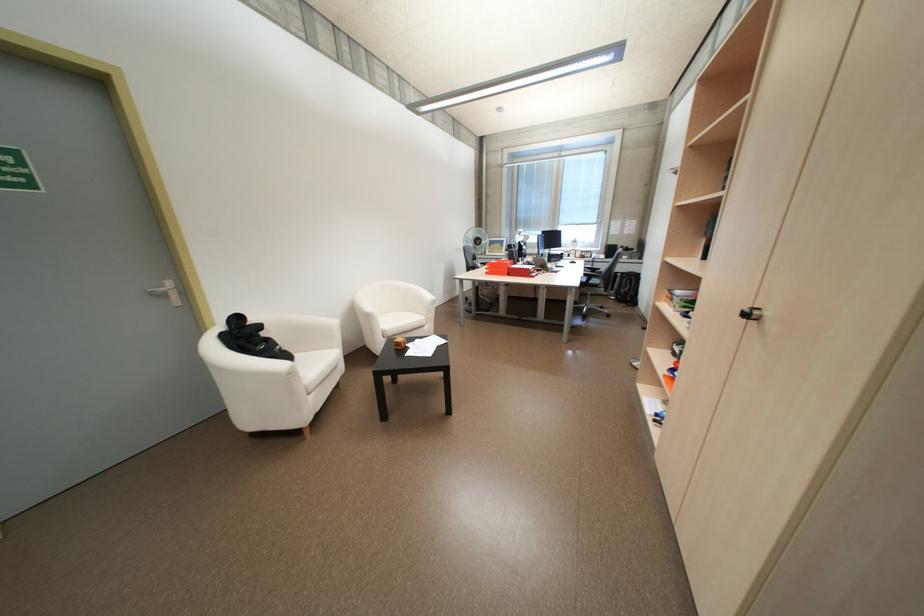
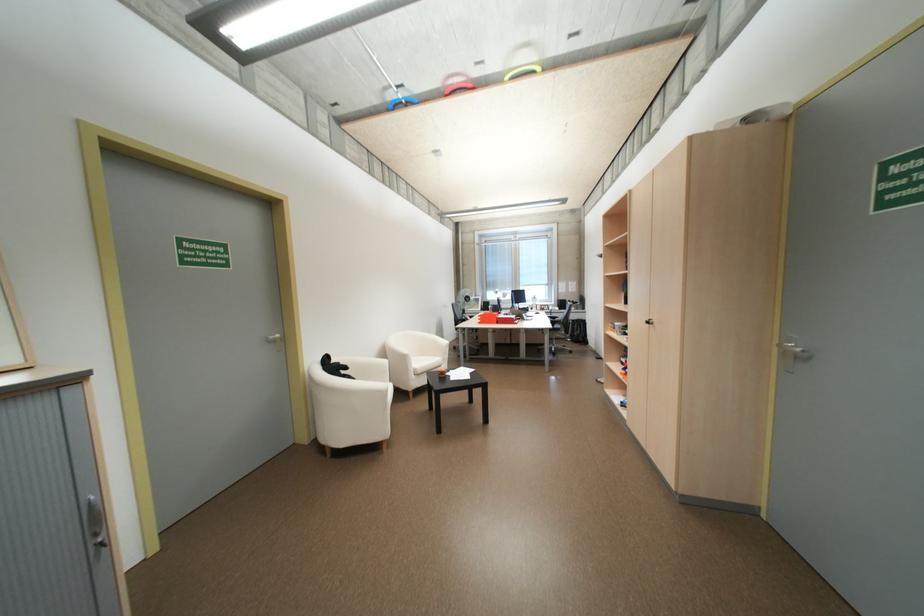
Which direction would the cameraman need to move to produce the second image?

The movement direction of the cameraman is left, backward.